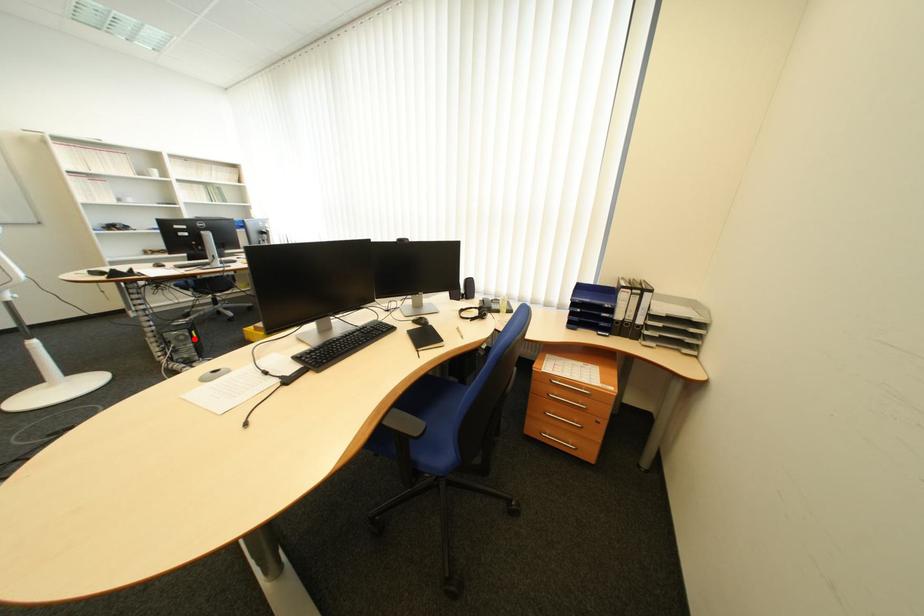
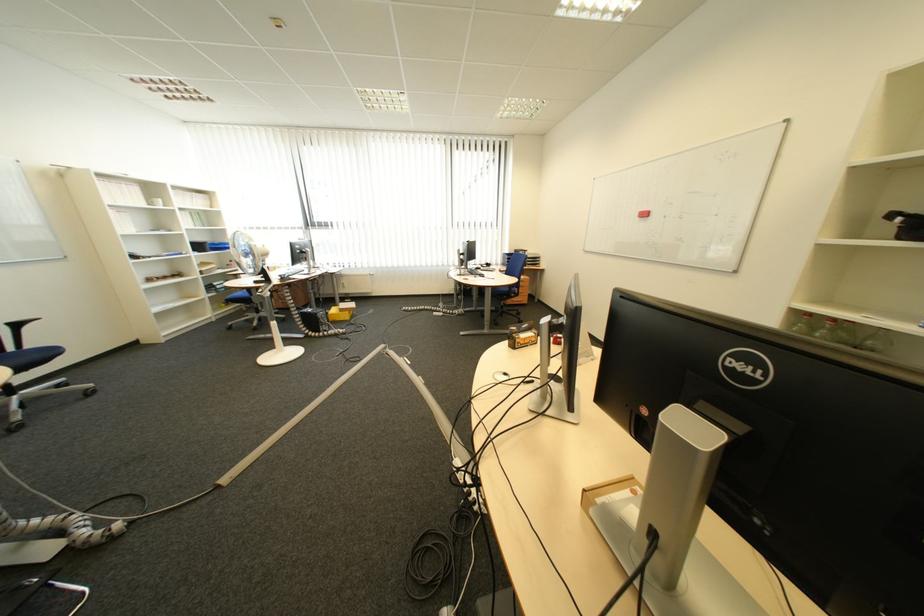
Question: I am providing you with two images of the same scene from different viewpoints. A red point is marked on the first image. At the location where the point appears in image 1, is it still visible in image 2?

Choices:
 (A) Yes
 (B) No

Answer: (A)